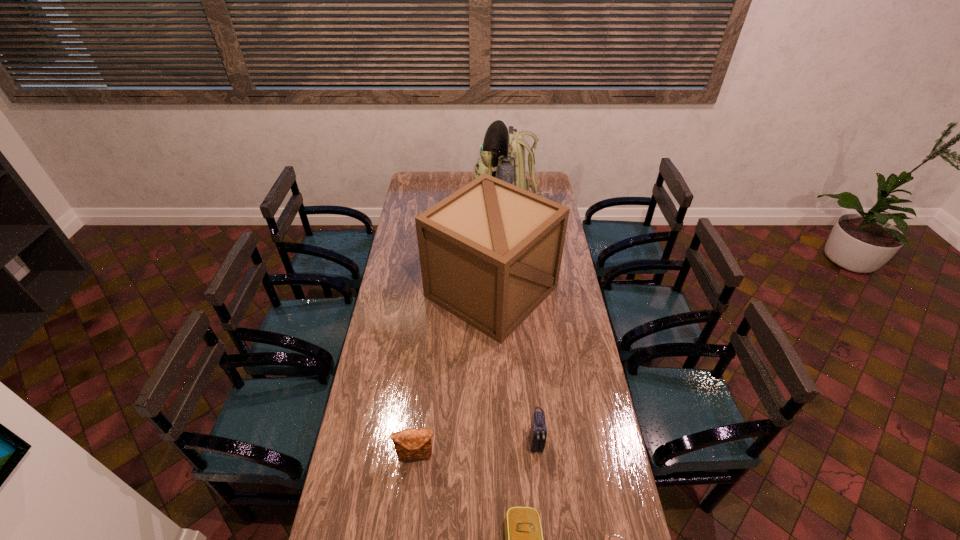
Locate an element on the screen. Image resolution: width=960 pixels, height=540 pixels. object that stands as the second closest to the nearest clutch bag is located at coordinates (538, 432).

Select which object is the second closest to the leftmost clutch bag. Please provide its 2D coordinates. Your answer should be formatted as a tuple, i.e. [(x, y)], where the tuple contains the x and y coordinates of a point satisfying the conditions above.

[(538, 432)]

This screenshot has width=960, height=540. I want to click on the closest clutch bag relative to the backpack, so click(538, 432).

You are a GUI agent. You are given a task and a screenshot of the screen. Output one action in this format:
    pyautogui.click(x=<x>, y=<y>)
    Task: Click on the clutch bag object that ranks as the third closest to the farthest object
    Image resolution: width=960 pixels, height=540 pixels.
    Given the screenshot: What is the action you would take?
    pyautogui.click(x=523, y=533)